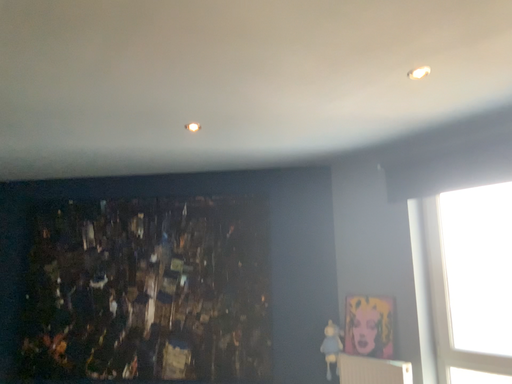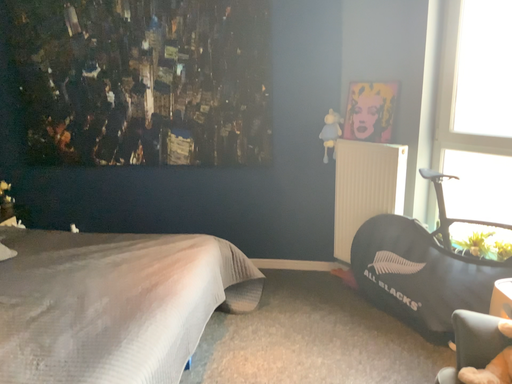
Question: Which way did the camera rotate in the video?

Choices:
 (A) rotated downward
 (B) rotated upward

Answer: (A)